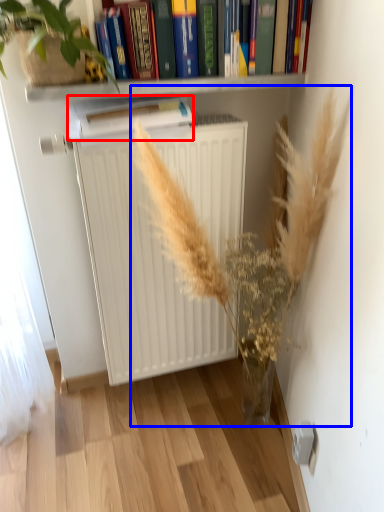
Question: Which of the following is the closest to the observer, paperback book (highlighted by a red box) or floral arrangement (highlighted by a blue box)?

Choices:
 (A) paperback book
 (B) floral arrangement

Answer: (B)